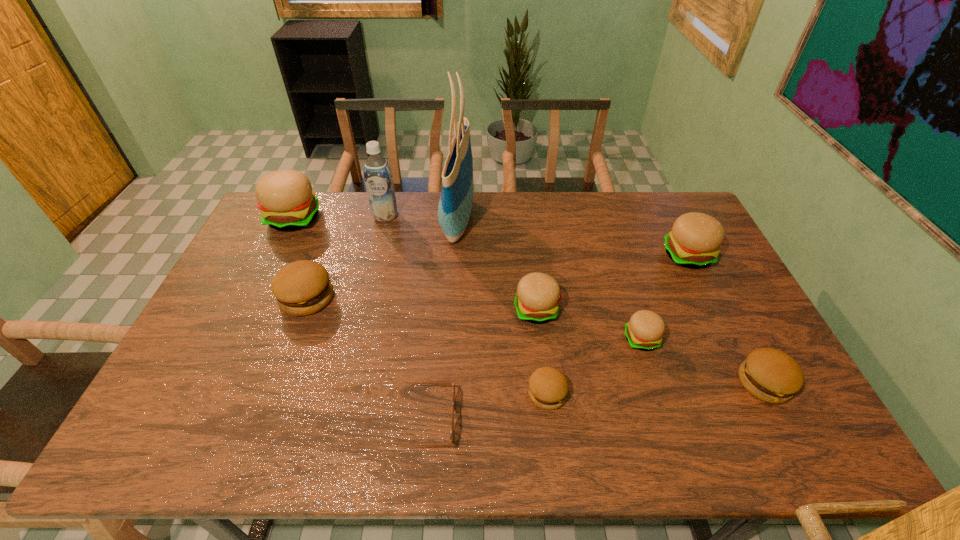
Select which hamburger is the fifth closest to the shortest object. Please provide its 2D coordinates. Your answer should be formatted as a tuple, i.e. [(x, y)], where the tuple contains the x and y coordinates of a point satisfying the conditions above.

[(286, 201)]

Image resolution: width=960 pixels, height=540 pixels. In order to click on hamburger that is the seventh nearest to the tallest object in this screenshot , I will do `click(770, 375)`.

Locate which beige hamburger is the fourth closest to the rightmost brown hamburger. Please provide its 2D coordinates. Your answer should be formatted as a tuple, i.e. [(x, y)], where the tuple contains the x and y coordinates of a point satisfying the conditions above.

[(286, 201)]

Find the location of a particular element. This screenshot has height=540, width=960. beige hamburger that is the closest to the third beige hamburger from right to left is located at coordinates (644, 331).

The width and height of the screenshot is (960, 540). In order to click on brown hamburger that stands as the third closest to the third tallest object in this screenshot , I will do `click(770, 375)`.

Point out which brown hamburger is positioned as the third nearest to the tallest object. Please provide its 2D coordinates. Your answer should be formatted as a tuple, i.e. [(x, y)], where the tuple contains the x and y coordinates of a point satisfying the conditions above.

[(770, 375)]

Identify the location of vacant position in the image that satisfies the following two spatial constraints: 1. on the label of the eighth object from right to left; 2. on the left side of the tote bag. (384, 221).

Locate an element on the screen. The width and height of the screenshot is (960, 540). vacant region that satisfies the following two spatial constraints: 1. on the label of the second tallest object; 2. on the left side of the blue tote bag is located at coordinates (384, 221).

Find the location of a particular element. The width and height of the screenshot is (960, 540). free space that satisfies the following two spatial constraints: 1. on the front side of the shortest hamburger; 2. on the left side of the leftmost brown hamburger is located at coordinates (271, 394).